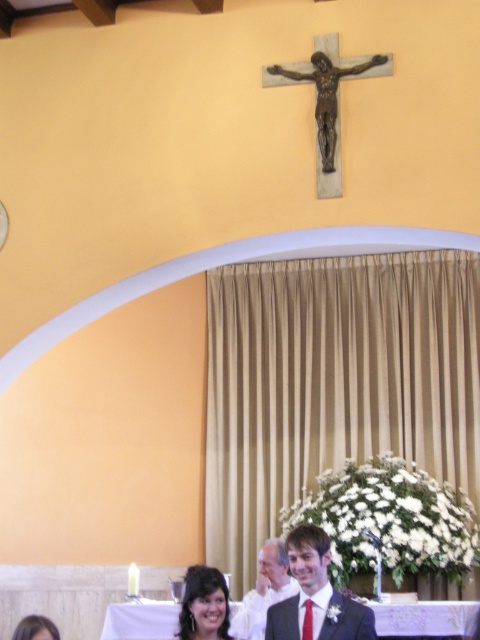
Can you confirm if matte black hair at lower center is positioned below matte black suit at lower center?

No.

Is point (204, 586) closer to viewer compared to point (237, 611)?

Yes, it is.

Which is behind, point (224, 625) or point (269, 554)?

The point (269, 554) is more distant.

This screenshot has height=640, width=480. I want to click on matte black hair at lower center, so click(204, 604).

Can you confirm if matte black suit at center is positioned to the left of matte black suit at lower center?

In fact, matte black suit at center is to the right of matte black suit at lower center.

Is matte black suit at center closer to the viewer compared to matte black suit at lower center?

Yes, matte black suit at center is in front of matte black suit at lower center.

Identify the location of matte black suit at center. (315, 595).

Between point (315, 577) and point (204, 632), which one is positioned behind?

The point (315, 577) is behind.

Between matte black suit at center and matte black hair at lower center, which one is positioned higher?

matte black suit at center is above.

Is point (287, 637) positioned before point (224, 580)?

Yes, it is.

Find the location of a particular element. The height and width of the screenshot is (640, 480). matte black suit at center is located at coordinates (315, 595).